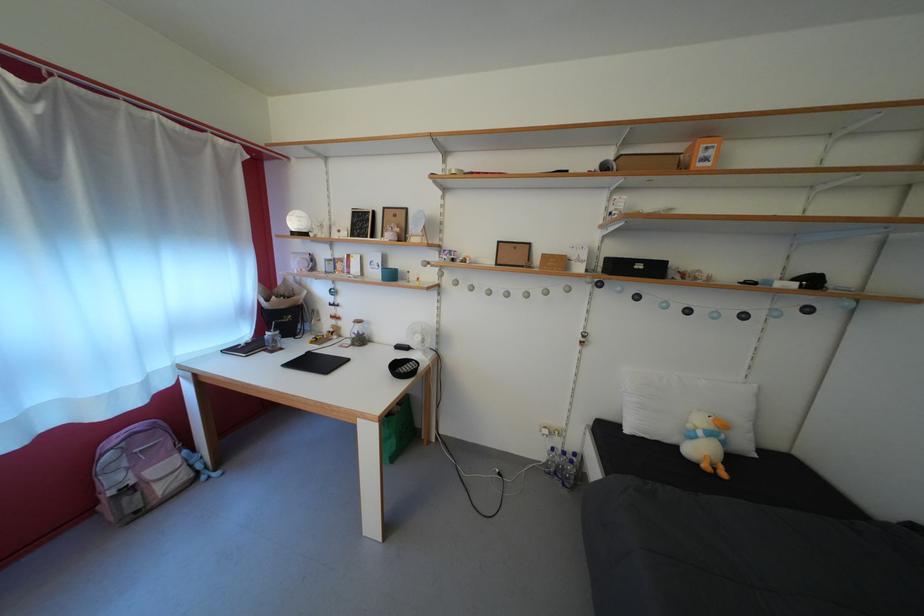
Where is `pink and grey backpack`? The height and width of the screenshot is (616, 924). pink and grey backpack is located at coordinates (139, 471).